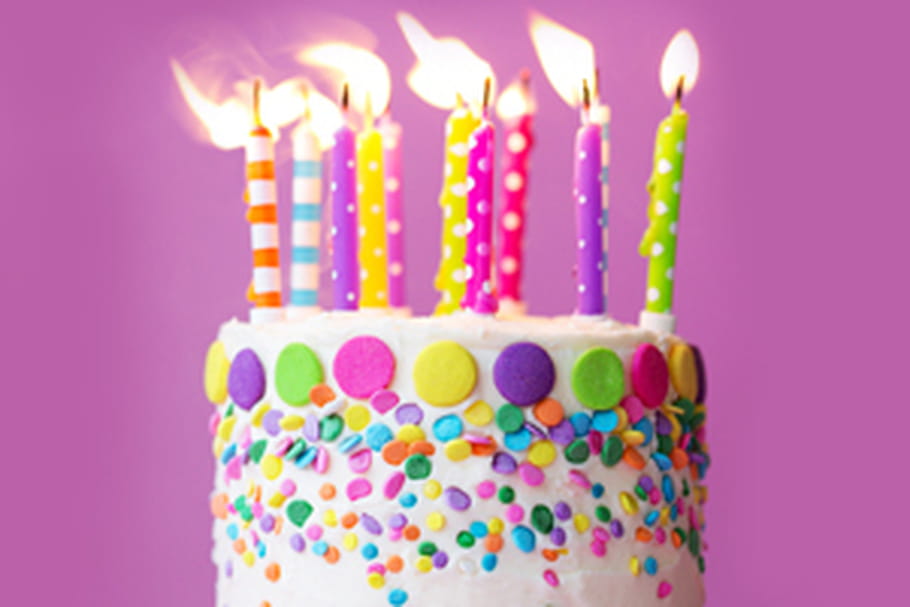
The width and height of the screenshot is (910, 607). I want to click on candle, so click(261, 257), click(305, 254), click(341, 266), click(373, 212), click(392, 211), click(456, 232), click(482, 236), click(521, 234), click(595, 243), click(668, 249).